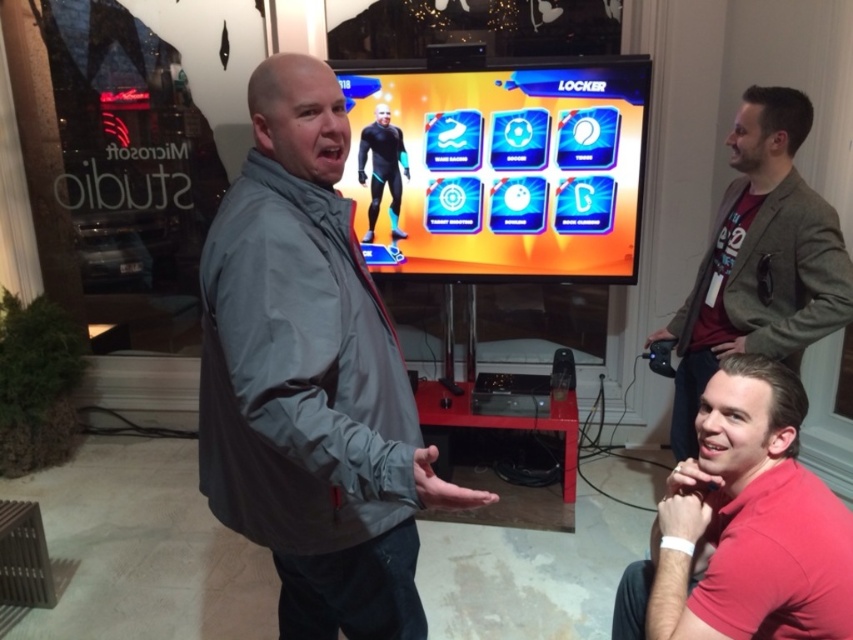
Question: Which object appears farthest from the camera in this image?

Choices:
 (A) shiny plastic game at center
 (B) red cotton shirt at lower right

Answer: (A)

Question: In this image, where is gray matte jacket at center located relative to green textured blazer at upper right?

Choices:
 (A) left
 (B) right

Answer: (A)

Question: Among these points, which one is farthest from the camera?

Choices:
 (A) (662, 339)
 (B) (751, 413)

Answer: (A)

Question: Is gray matte jacket at center below green textured blazer at upper right?

Choices:
 (A) yes
 (B) no

Answer: (A)

Question: Which point is closer to the camera taking this photo?

Choices:
 (A) (799, 410)
 (B) (717, 308)
 (C) (341, 86)
 (D) (393, 140)

Answer: (A)

Question: Can you confirm if gray matte jacket at center is positioned below red cotton shirt at lower right?

Choices:
 (A) yes
 (B) no

Answer: (B)